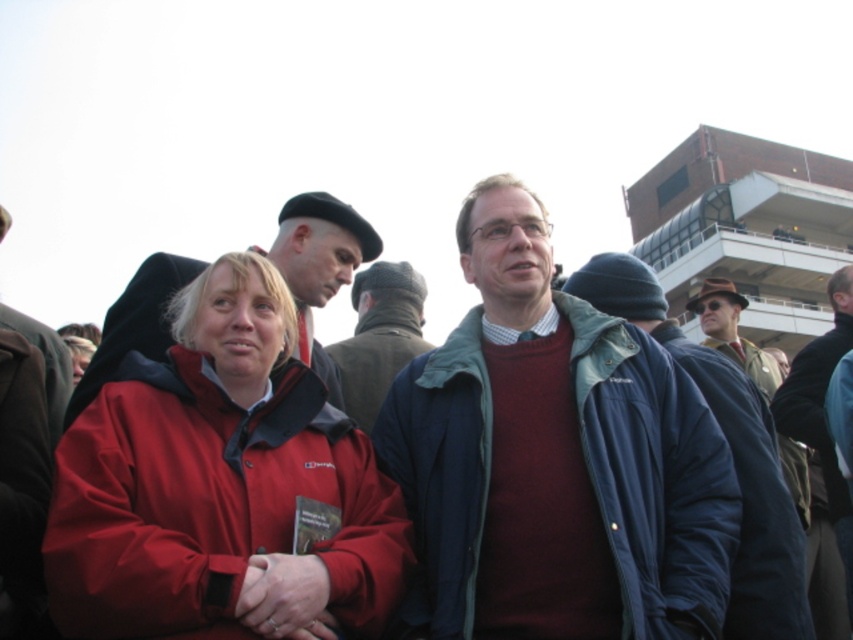
Question: Among these objects, which one is nearest to the camera?

Choices:
 (A) matte red jacket at center
 (B) brown leather hat at upper right
 (C) matte black beret at upper left
 (D) maroon sweater at center

Answer: (A)

Question: Which point is farther to the camera?

Choices:
 (A) maroon sweater at center
 (B) matte red jacket at center

Answer: (A)

Question: Observing the image, what is the correct spatial positioning of maroon sweater at center in reference to dark brown leather jacket at left?

Choices:
 (A) right
 (B) left

Answer: (A)

Question: Can you confirm if dark blue jacket at center is smaller than brown leather hat at upper right?

Choices:
 (A) no
 (B) yes

Answer: (B)

Question: Can you confirm if blue fabric jacket at center is positioned to the right of blue denim jacket at center?

Choices:
 (A) no
 (B) yes

Answer: (B)

Question: Which of the following is the farthest from the observer?

Choices:
 (A) (32, 328)
 (B) (821, 378)
 (C) (361, 332)

Answer: (C)